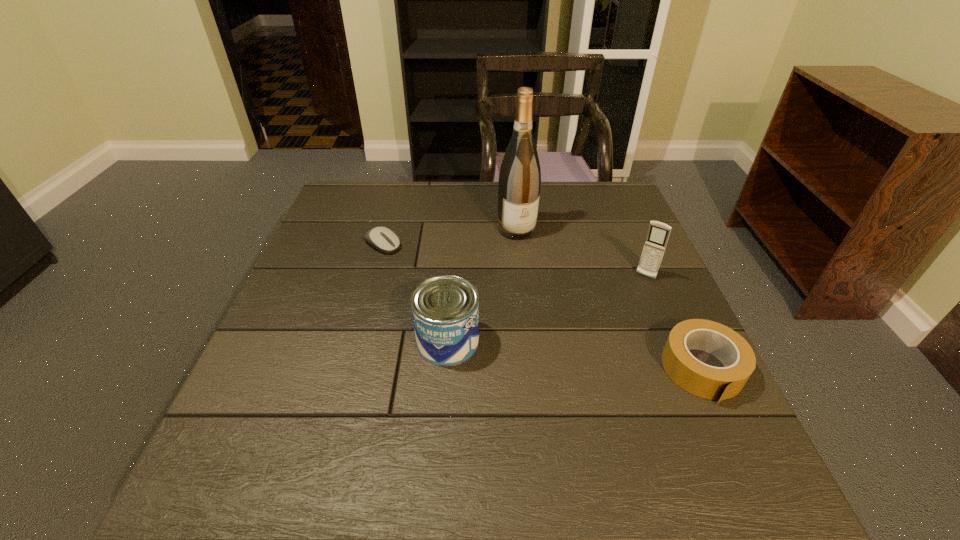
This screenshot has width=960, height=540. Identify the location of free point between the duct tape and the third shortest object. (575, 355).

Find the location of a particular element. unoccupied position between the second object from left to right and the duct tape is located at coordinates (575, 355).

The height and width of the screenshot is (540, 960). I want to click on vacant space that's between the leftmost object and the wine bottle, so click(449, 237).

The width and height of the screenshot is (960, 540). Identify the location of empty space that is in between the wine bottle and the fourth tallest object. (610, 300).

You are a GUI agent. You are given a task and a screenshot of the screen. Output one action in this format:
    pyautogui.click(x=<x>, y=<y>)
    Task: Click on the free space between the wine bottle and the third farthest object
    Image resolution: width=960 pixels, height=540 pixels.
    Given the screenshot: What is the action you would take?
    pyautogui.click(x=581, y=253)

This screenshot has height=540, width=960. In order to click on free area in between the third object from left to right and the leftmost object in this screenshot , I will do `click(449, 237)`.

Locate an element on the screen. The image size is (960, 540). vacant space that's between the wine bottle and the second object from left to right is located at coordinates (482, 286).

This screenshot has width=960, height=540. Identify the location of unoccupied position between the second tallest object and the second shortest object. (674, 323).

Identify which object is the second nearest to the fourth tallest object. Please provide its 2D coordinates. Your answer should be formatted as a tuple, i.e. [(x, y)], where the tuple contains the x and y coordinates of a point satisfying the conditions above.

[(445, 309)]

Find the location of a particular element. Image resolution: width=960 pixels, height=540 pixels. object that is the nearest to the cellular telephone is located at coordinates (713, 383).